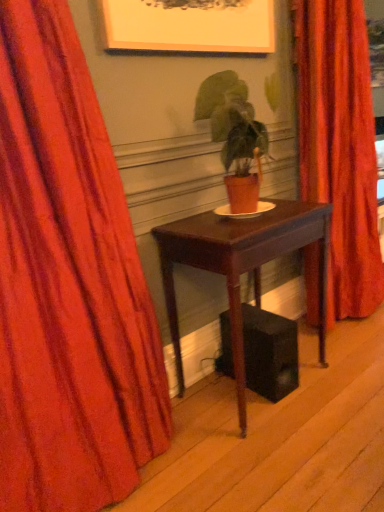
Image resolution: width=384 pixels, height=512 pixels. I want to click on vacant space in front of mahogany wood table at center, so click(x=279, y=453).